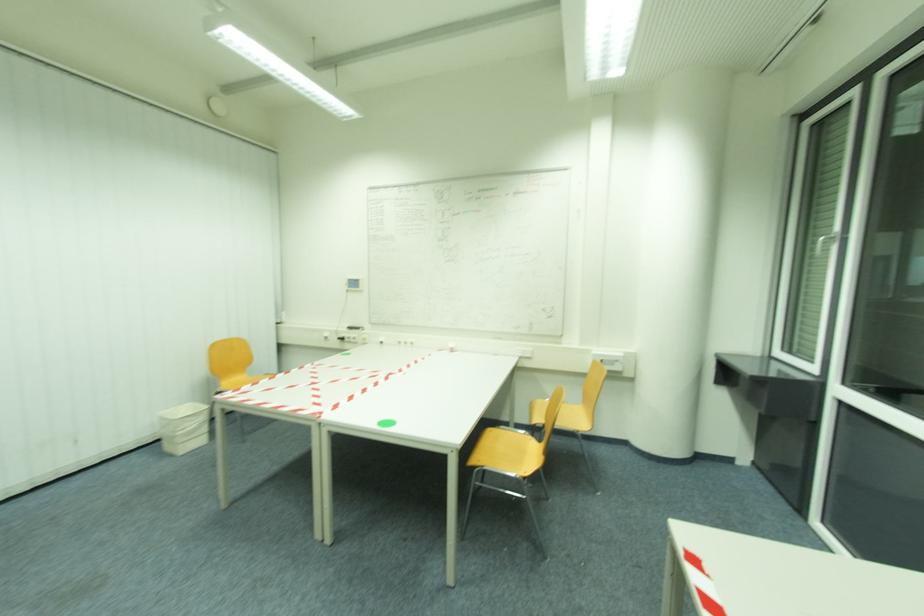
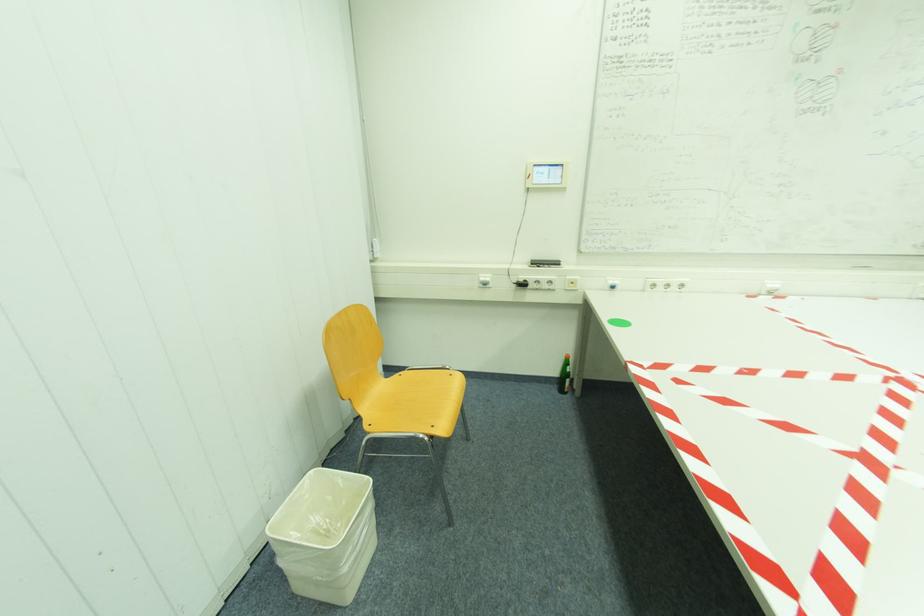
From the picture: What movement of the cameraman would produce the second image?

The movement direction of the cameraman is left, forward.